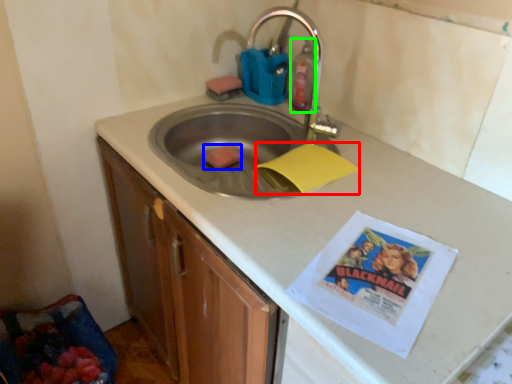
Question: Which object is the closest to the paper (highlighted by a red box)? Choose among these: food (highlighted by a blue box) or cleaning product (highlighted by a green box).

Choices:
 (A) food
 (B) cleaning product

Answer: (B)